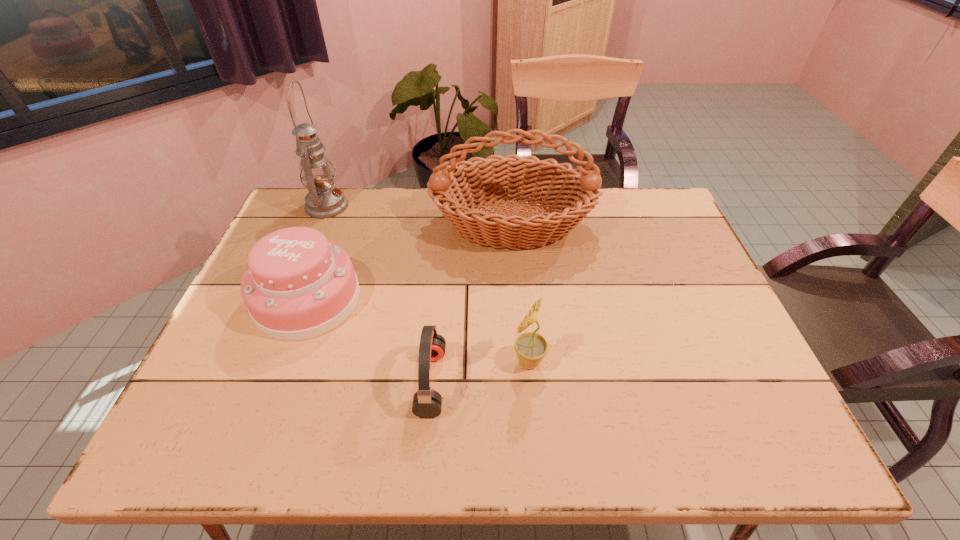
You are a GUI agent. You are given a task and a screenshot of the screen. Output one action in this format:
    pyautogui.click(x=<x>, y=<y>)
    Task: Click on the vacant space located on the front of the birthday cake
    
    Given the screenshot: What is the action you would take?
    pyautogui.click(x=282, y=367)

The height and width of the screenshot is (540, 960). Find the location of `vacant space located 0.200m on the ear cups of the earphone`. vacant space located 0.200m on the ear cups of the earphone is located at coordinates click(x=536, y=382).

This screenshot has width=960, height=540. I want to click on oil lamp at the far edge, so click(324, 200).

Where is `basket that is at the far edge`? basket that is at the far edge is located at coordinates (571, 194).

The width and height of the screenshot is (960, 540). Identify the location of object that is at the near edge. (427, 402).

Locate an element on the screen. This screenshot has width=960, height=540. oil lamp that is at the left edge is located at coordinates (324, 200).

The image size is (960, 540). In order to click on birthday cake present at the left edge in this screenshot , I will do `click(298, 285)`.

Identify the location of object located at the far left corner. The height and width of the screenshot is (540, 960). (324, 200).

Locate an element on the screen. vacant space at the far edge of the desktop is located at coordinates (381, 199).

You are a GUI agent. You are given a task and a screenshot of the screen. Output one action in this format:
    pyautogui.click(x=<x>, y=<y>)
    Task: Click on the free location at the near edge of the desktop
    This screenshot has height=540, width=960.
    Given the screenshot: What is the action you would take?
    pyautogui.click(x=295, y=446)